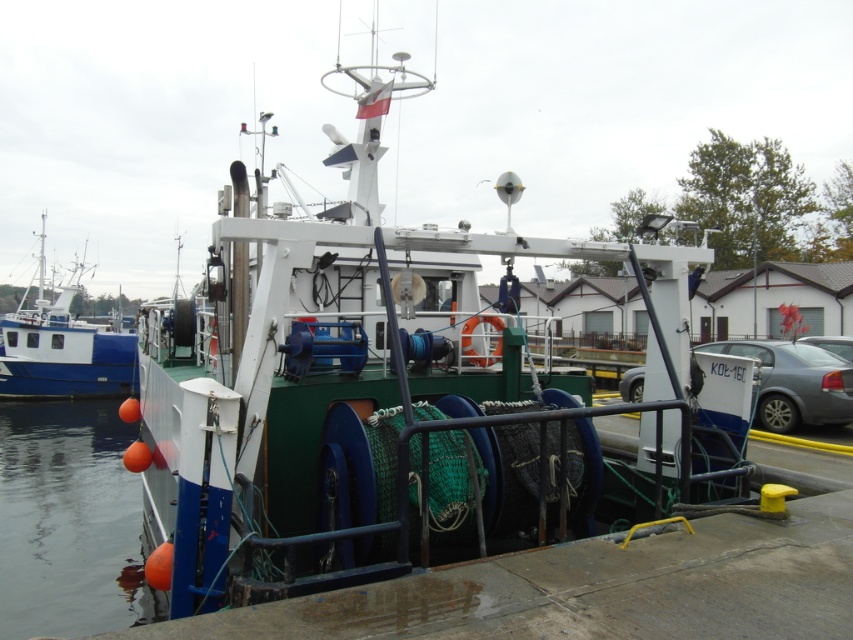
Question: Does green matte boat at center appear over silver metallic car at right?

Choices:
 (A) yes
 (B) no

Answer: (A)

Question: Is blue matte boat at left thinner than silver metallic car at right?

Choices:
 (A) no
 (B) yes

Answer: (A)

Question: In this image, where is blue matte boat at left located relative to silver metallic car at right?

Choices:
 (A) left
 (B) right

Answer: (A)

Question: Among these objects, which one is nearest to the camera?

Choices:
 (A) silver metallic car at right
 (B) blue matte boat at left
 (C) orange rubber buoy at lower left

Answer: (C)

Question: Which point is closer to the camera?

Choices:
 (A) (68, 518)
 (B) (763, 358)

Answer: (A)

Question: Which object appears closest to the camera in this image?

Choices:
 (A) silver metallic car at right
 (B) green matte boat at center
 (C) blue matte boat at left
 (D) orange rubber buoy at lower left

Answer: (B)